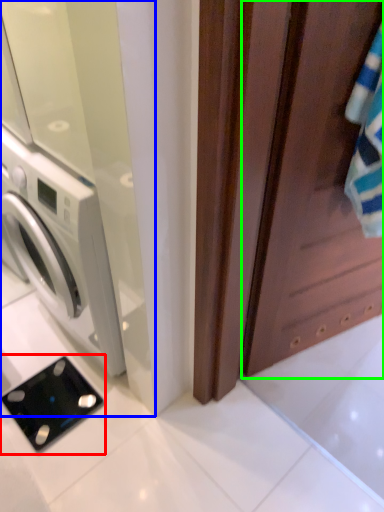
Question: Based on their relative distances, which object is nearer to appliance (highlighted by a red box)? Choose from screen door (highlighted by a blue box) and screen door (highlighted by a green box).

Choices:
 (A) screen door
 (B) screen door

Answer: (A)